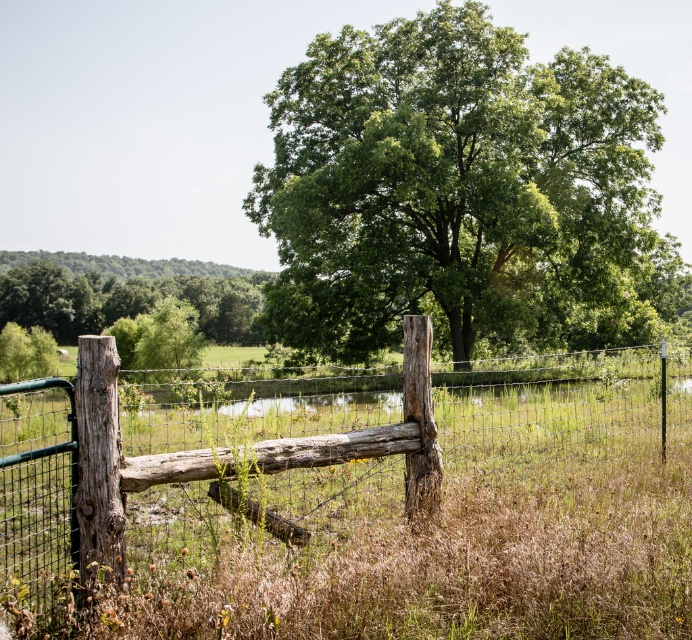
Question: Is weathered wood fence at left positioned behind green leafy tree at center?

Choices:
 (A) yes
 (B) no

Answer: (B)

Question: Which of the following is the farthest from the observer?

Choices:
 (A) weathered wood fence at left
 (B) green leafy tree at upper center

Answer: (B)

Question: Is weathered wood fence at left wider than green leafy tree at upper center?

Choices:
 (A) yes
 (B) no

Answer: (B)

Question: Which of the following is the farthest from the observer?

Choices:
 (A) green leafy tree at center
 (B) weathered wood fence at left

Answer: (A)

Question: Based on their relative distances, which object is nearer to the weathered wood fence at left?

Choices:
 (A) green leafy tree at upper center
 (B) green leafy tree at center

Answer: (B)

Question: Does green leafy tree at center appear over green leafy tree at upper center?

Choices:
 (A) no
 (B) yes

Answer: (B)